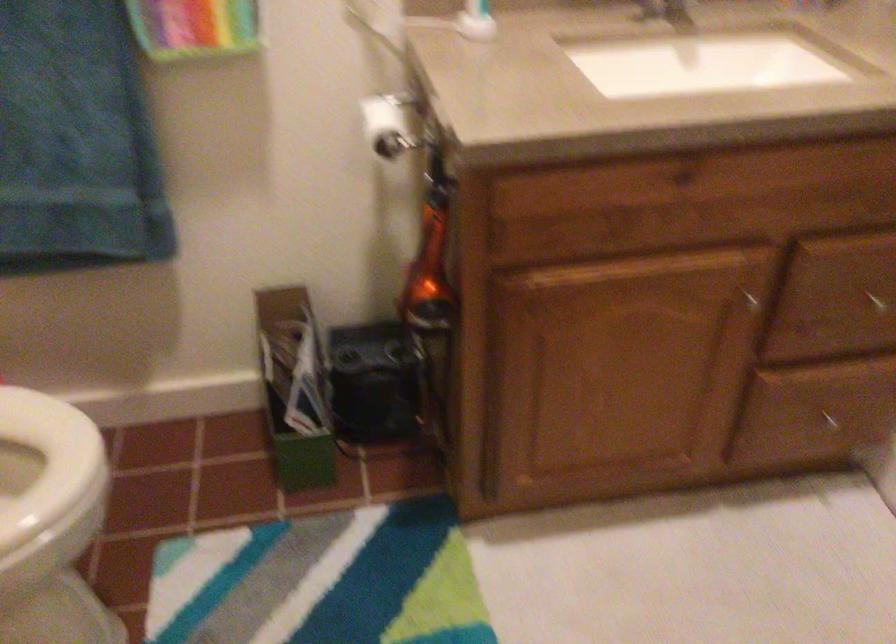
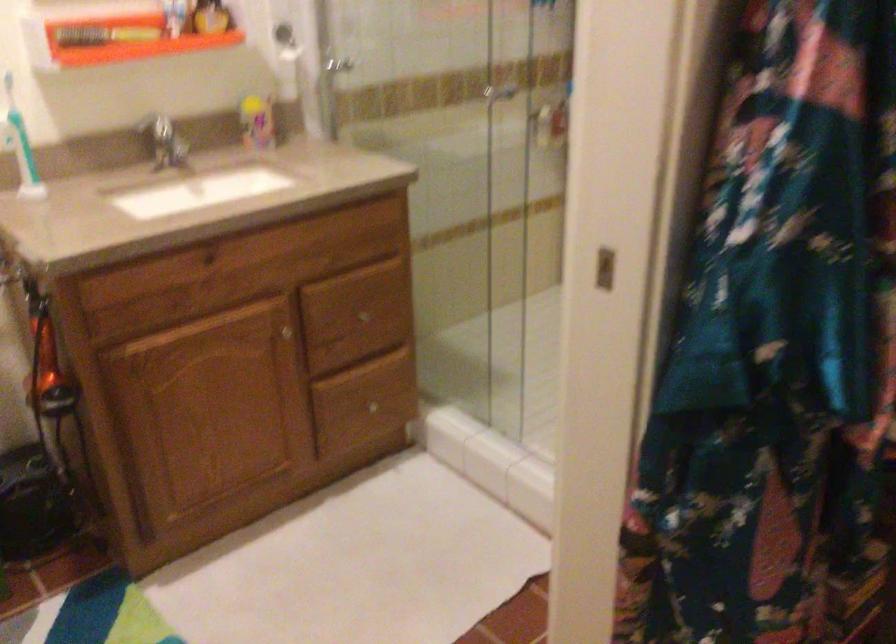
Question: The camera is either moving clockwise (left) or counter-clockwise (right) around the object. The first image is from the beginning of the video and the second image is from the end. Is the camera moving left or right when shooting the video?

Choices:
 (A) Left
 (B) Right

Answer: (A)